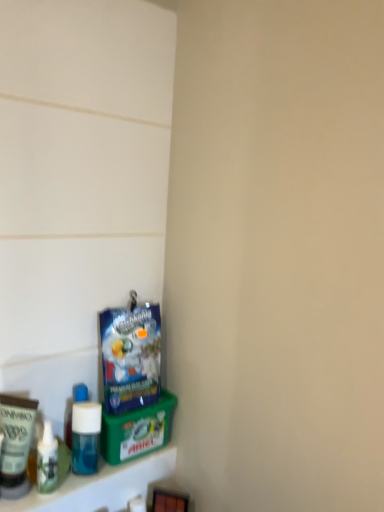
Question: Is blue plastic bag at lower left further to camera compared to translucent plastic soap dispenser at lower left, which is the first toiletry from right to left?

Choices:
 (A) yes
 (B) no

Answer: (A)

Question: From the image's perspective, does blue plastic bag at lower left appear higher than translucent plastic soap dispenser at lower left, which is the first toiletry from right to left?

Choices:
 (A) no
 (B) yes

Answer: (B)

Question: Is blue plastic bag at lower left positioned beyond the bounds of translucent plastic soap dispenser at lower left, which is the first toiletry from right to left?

Choices:
 (A) no
 (B) yes

Answer: (B)

Question: Is blue plastic bag at lower left placed right next to translucent plastic soap dispenser at lower left, which is the second toiletry from left to right?

Choices:
 (A) yes
 (B) no

Answer: (B)

Question: Is blue plastic bag at lower left positioned with its back to translucent plastic soap dispenser at lower left, which is the second toiletry from left to right?

Choices:
 (A) yes
 (B) no

Answer: (B)

Question: Is blue plastic bag at lower left surrounding translucent plastic soap dispenser at lower left, which is the first toiletry from right to left?

Choices:
 (A) no
 (B) yes

Answer: (A)

Question: Does translucent plastic soap dispenser at lower left, which is the first toiletry from right to left, have a greater height compared to blue matte bottle at lower left?

Choices:
 (A) no
 (B) yes

Answer: (B)

Question: From a real-world perspective, is translucent plastic soap dispenser at lower left, which is the second toiletry from left to right, on top of blue matte bottle at lower left?

Choices:
 (A) no
 (B) yes

Answer: (B)

Question: Is the surface of translucent plastic soap dispenser at lower left, which is the first toiletry from right to left, in direct contact with blue matte bottle at lower left?

Choices:
 (A) yes
 (B) no

Answer: (A)

Question: Is translucent plastic soap dispenser at lower left, which is the first toiletry from right to left, facing away from blue matte bottle at lower left?

Choices:
 (A) no
 (B) yes

Answer: (A)

Question: From the image's perspective, is translucent plastic soap dispenser at lower left, which is the first toiletry from right to left, located beneath blue matte bottle at lower left?

Choices:
 (A) no
 (B) yes

Answer: (A)

Question: From a real-world perspective, is translucent plastic soap dispenser at lower left, which is the second toiletry from left to right, located beneath blue matte bottle at lower left?

Choices:
 (A) no
 (B) yes

Answer: (A)

Question: Is blue plastic bag at lower left completely or partially outside of blue matte bottle at lower left?

Choices:
 (A) no
 (B) yes

Answer: (B)